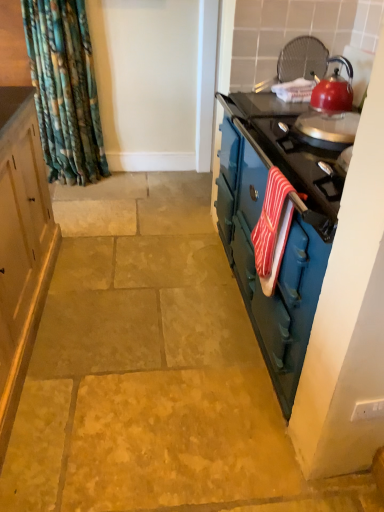
Question: Is the depth of red striped towel at right less than that of teal glossy dresser at right?

Choices:
 (A) yes
 (B) no

Answer: (B)

Question: Is red striped towel at right positioned with its back to teal glossy dresser at right?

Choices:
 (A) no
 (B) yes

Answer: (B)

Question: Does red striped towel at right have a lesser width compared to teal glossy dresser at right?

Choices:
 (A) no
 (B) yes

Answer: (B)

Question: From the image's perspective, is red striped towel at right above teal glossy dresser at right?

Choices:
 (A) yes
 (B) no

Answer: (B)

Question: From the image's perspective, would you say red striped towel at right is shown under teal glossy dresser at right?

Choices:
 (A) no
 (B) yes

Answer: (B)

Question: From a real-world perspective, is red striped towel at right located higher than teal glossy dresser at right?

Choices:
 (A) yes
 (B) no

Answer: (A)

Question: From a real-world perspective, is teal glossy dresser at right on red striped towel at right?

Choices:
 (A) yes
 (B) no

Answer: (B)

Question: Can you confirm if teal glossy dresser at right is smaller than red striped towel at right?

Choices:
 (A) yes
 (B) no

Answer: (B)

Question: From a real-world perspective, is teal glossy dresser at right below red striped towel at right?

Choices:
 (A) yes
 (B) no

Answer: (A)

Question: Is teal glossy dresser at right aimed at red striped towel at right?

Choices:
 (A) yes
 (B) no

Answer: (A)

Question: From the image's perspective, is teal glossy dresser at right on top of red striped towel at right?

Choices:
 (A) yes
 (B) no

Answer: (A)

Question: Considering the relative sizes of teal glossy dresser at right and red striped towel at right in the image provided, is teal glossy dresser at right taller than red striped towel at right?

Choices:
 (A) no
 (B) yes

Answer: (B)

Question: Is red striped towel at right at the right side of shiny red kettle at upper right?

Choices:
 (A) yes
 (B) no

Answer: (B)